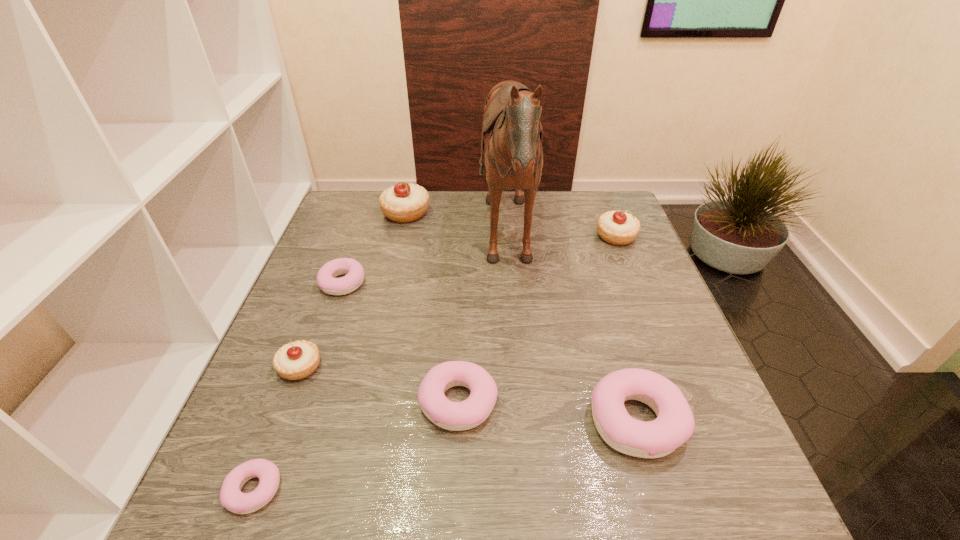
Where is `beige pastry that stands as the third closest to the second shortest pastry`? This screenshot has height=540, width=960. beige pastry that stands as the third closest to the second shortest pastry is located at coordinates (x=619, y=228).

Identify which pink pastry is the fourth closest to the leftmost beige pastry. Please provide its 2D coordinates. Your answer should be formatted as a tuple, i.e. [(x, y)], where the tuple contains the x and y coordinates of a point satisfying the conditions above.

[(674, 425)]

At what (x,y) coordinates should I click in order to perform the action: click on pink pastry identified as the second closest to the rightmost pink pastry. Please return your answer as a coordinate pair (x, y). Looking at the image, I should click on (231, 497).

This screenshot has height=540, width=960. I want to click on vacant area in the image that satisfies the following two spatial constraints: 1. on the back of the brown saddle; 2. on the front side of the third biggest pink pastry, so click(x=512, y=283).

Where is `free space that satisfies the following two spatial constraints: 1. on the back side of the leftmost beige pastry; 2. on the left side of the second tallest pastry`? This screenshot has width=960, height=540. free space that satisfies the following two spatial constraints: 1. on the back side of the leftmost beige pastry; 2. on the left side of the second tallest pastry is located at coordinates (349, 237).

Find the location of a particular element. Image resolution: width=960 pixels, height=540 pixels. blank area in the image that satisfies the following two spatial constraints: 1. on the front side of the third biggest pink pastry; 2. on the right side of the sixth tallest object is located at coordinates click(300, 402).